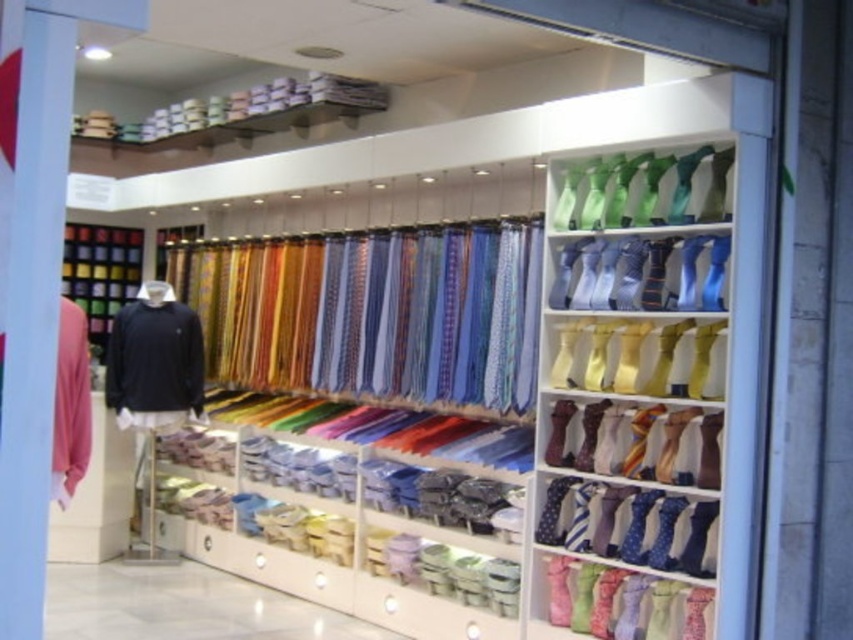
Is shiny silk ties at center shorter than matte pink sweater at left?

Incorrect, shiny silk ties at center's height does not fall short of matte pink sweater at left's.

Does shiny silk ties at center come behind matte pink sweater at left?

Yes, shiny silk ties at center is behind matte pink sweater at left.

Is point (396, 385) closer to viewer compared to point (71, 417)?

No, (396, 385) is behind (71, 417).

At what (x,y) coordinates should I click in order to perform the action: click on shiny silk ties at center. Please return your answer as a coordinate pair (x, y). This screenshot has width=853, height=640. Looking at the image, I should click on (374, 312).

Can you confirm if black matte sweater at left is positioned above matte pink sweater at left?

Correct, black matte sweater at left is located above matte pink sweater at left.

Is black matte sweater at left positioned before matte pink sweater at left?

No, black matte sweater at left is behind matte pink sweater at left.

Who is more distant from viewer, (151, 285) or (78, 454)?

Positioned behind is point (151, 285).

Locate an element on the screen. This screenshot has width=853, height=640. black matte sweater at left is located at coordinates (155, 362).

Which is behind, point (618, 269) or point (427, 349)?

The point (427, 349) is more distant.

How distant is shiny silk ties at upper right from shiny silk ties at center?

shiny silk ties at upper right is 3.37 feet from shiny silk ties at center.

Is point (666, 211) positioned before point (473, 250)?

Yes.

Where is `shiny silk ties at upper right`? The image size is (853, 640). shiny silk ties at upper right is located at coordinates (631, 385).